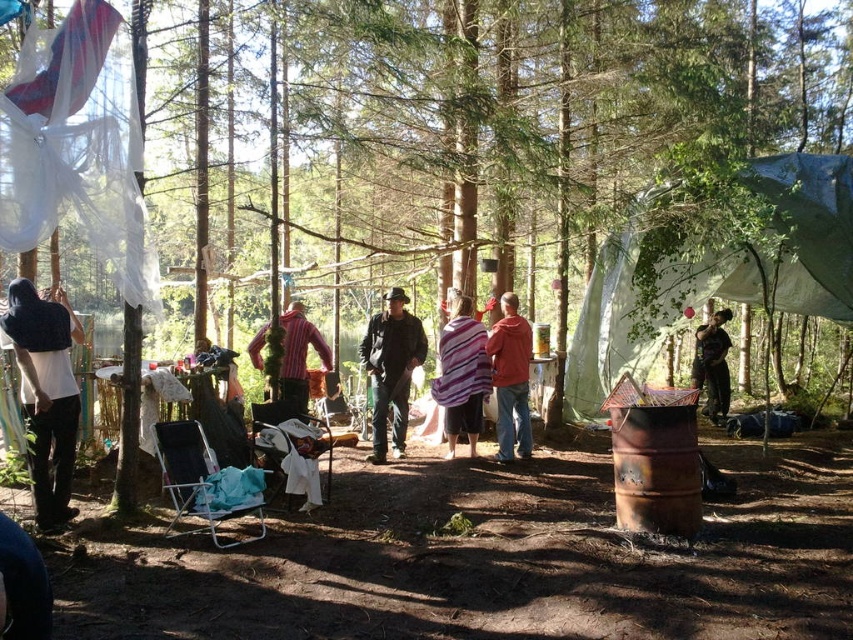
Between striped fabric shirt at center and dark brown leather jacket at lower right, which one is positioned higher?

Positioned higher is striped fabric shirt at center.

The width and height of the screenshot is (853, 640). Describe the element at coordinates (299, 356) in the screenshot. I see `striped fabric shirt at center` at that location.

Between point (300, 355) and point (706, 387), which one is positioned in front?

Positioned in front is point (300, 355).

This screenshot has width=853, height=640. In order to click on striped fabric shirt at center in this screenshot , I will do `click(299, 356)`.

Is green tarpaulin tent at center-right shorter than matte red shirt at center?

In fact, green tarpaulin tent at center-right may be taller than matte red shirt at center.

Which is behind, point (784, 221) or point (505, 445)?

The point (784, 221) is behind.

This screenshot has width=853, height=640. What are the coordinates of `green tarpaulin tent at center-right` in the screenshot? It's located at (714, 275).

Does matte black jacket at center lie in front of striped fabric scarf at center?

No, matte black jacket at center is behind striped fabric scarf at center.

Can you confirm if matte black jacket at center is smaller than striped fabric scarf at center?

No, matte black jacket at center is not smaller than striped fabric scarf at center.

Is point (380, 433) positioned in front of point (454, 438)?

Yes, it is in front of point (454, 438).

In order to click on matte black jacket at center in this screenshot , I will do `click(392, 369)`.